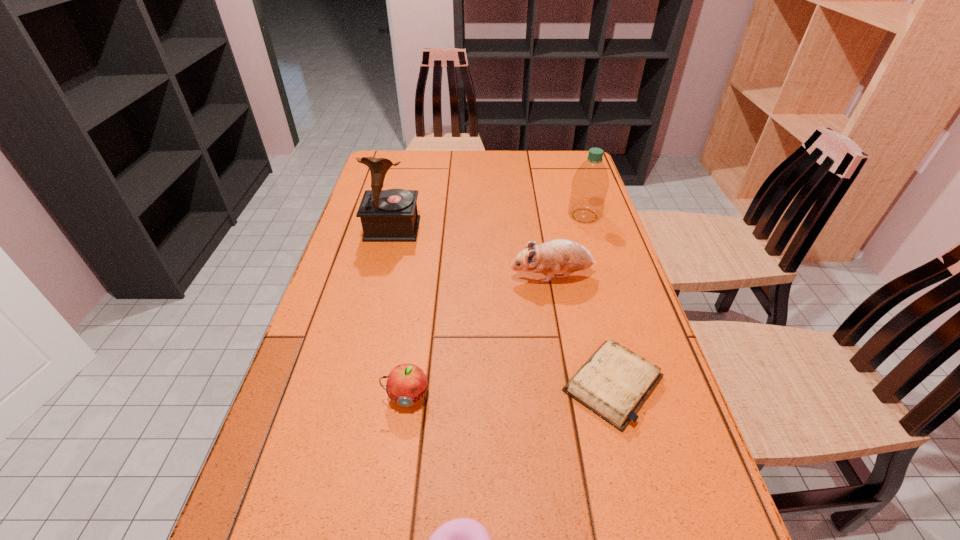
This screenshot has height=540, width=960. In order to click on free space that satisfies the following two spatial constraints: 1. on the front side of the fifth shortest object; 2. at the face of the third farthest object in this screenshot , I will do `click(603, 276)`.